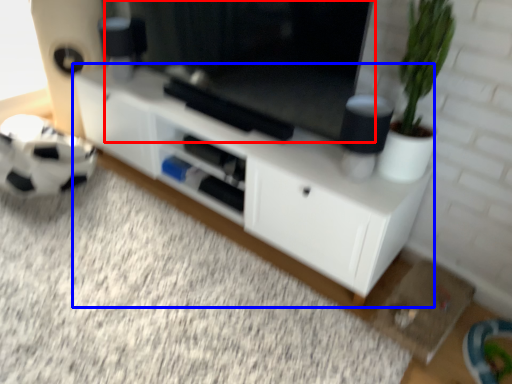
Question: Which of the following is the farthest to the observer, window screen (highlighted by a red box) or cabinetry (highlighted by a blue box)?

Choices:
 (A) window screen
 (B) cabinetry

Answer: (B)